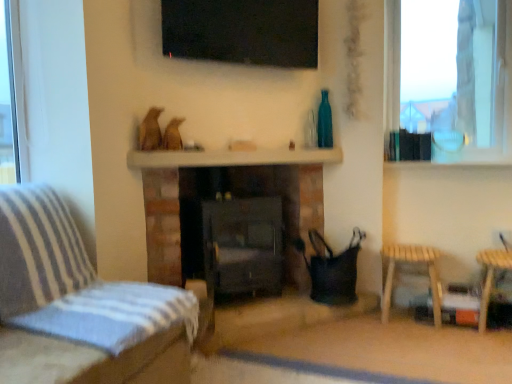
Question: Is teal glass bottle at upper right closer to the viewer compared to white glossy mantle at center?

Choices:
 (A) yes
 (B) no

Answer: (B)

Question: Is teal glass bottle at upper right to the right of white glossy mantle at center from the viewer's perspective?

Choices:
 (A) no
 (B) yes

Answer: (B)

Question: Is teal glass bottle at upper right beside white glossy mantle at center?

Choices:
 (A) no
 (B) yes

Answer: (A)

Question: Is teal glass bottle at upper right positioned with its back to white glossy mantle at center?

Choices:
 (A) yes
 (B) no

Answer: (B)

Question: Can you confirm if teal glass bottle at upper right is bigger than white glossy mantle at center?

Choices:
 (A) yes
 (B) no

Answer: (B)

Question: Is teal glass bottle at upper right oriented towards white glossy mantle at center?

Choices:
 (A) yes
 (B) no

Answer: (B)

Question: Does black glass tv at upper center have a smaller size compared to white glossy mantle at center?

Choices:
 (A) yes
 (B) no

Answer: (B)

Question: Can white glossy mantle at center be found inside black glass tv at upper center?

Choices:
 (A) yes
 (B) no

Answer: (B)

Question: Considering the relative sizes of black glass tv at upper center and white glossy mantle at center in the image provided, is black glass tv at upper center shorter than white glossy mantle at center?

Choices:
 (A) yes
 (B) no

Answer: (B)

Question: From the image's perspective, is black glass tv at upper center on white glossy mantle at center?

Choices:
 (A) yes
 (B) no

Answer: (A)

Question: Is black glass tv at upper center positioned far away from white glossy mantle at center?

Choices:
 (A) yes
 (B) no

Answer: (B)

Question: Considering the relative positions of black glass tv at upper center and white glossy mantle at center in the image provided, is black glass tv at upper center to the left of white glossy mantle at center from the viewer's perspective?

Choices:
 (A) yes
 (B) no

Answer: (A)

Question: Is transparent glass window at upper right positioned with its back to black glass tv at upper center?

Choices:
 (A) no
 (B) yes

Answer: (A)